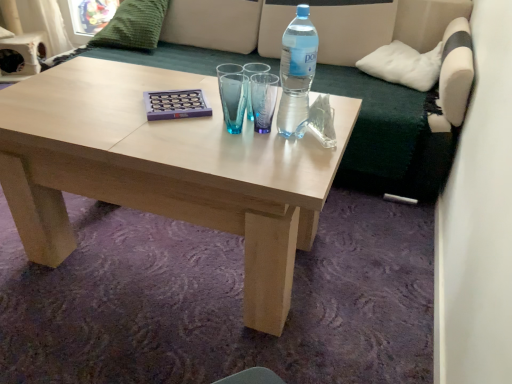
This screenshot has height=384, width=512. What do you see at coordinates (403, 65) in the screenshot?
I see `white soft cushion at upper right, the second pillow from the top` at bounding box center [403, 65].

Image resolution: width=512 pixels, height=384 pixels. Find the location of `transparent plastic bottle at upper right`. transparent plastic bottle at upper right is located at coordinates (297, 72).

Measure the distance between point (148,9) and camera.

Point (148,9) and camera are 7.57 feet apart.

Describe the element at coordinates (404, 41) in the screenshot. I see `green fabric couch at upper center` at that location.

Image resolution: width=512 pixels, height=384 pixels. I want to click on white soft cushion at upper right, arranged as the second pillow when viewed from the left, so click(x=403, y=65).

From a real-world perspective, relative to natural wood coffee table at center, is white soft cushion at upper right, arranged as the first pillow when viewed from the right, vertically above or below?

Clearly, from a real-world perspective, white soft cushion at upper right, arranged as the first pillow when viewed from the right, is above natural wood coffee table at center.

Which is more to the left, white soft cushion at upper right, marked as the 1th pillow in a bottom-to-top arrangement, or natural wood coffee table at center?

From the viewer's perspective, natural wood coffee table at center appears more on the left side.

Between white soft cushion at upper right, arranged as the first pillow when viewed from the right, and natural wood coffee table at center, which one has less height?

natural wood coffee table at center.

Considering the sizes of white soft cushion at upper right, arranged as the first pillow when viewed from the right, and natural wood coffee table at center in the image, is white soft cushion at upper right, arranged as the first pillow when viewed from the right, wider or thinner than natural wood coffee table at center?

In the image, white soft cushion at upper right, arranged as the first pillow when viewed from the right, appears to be more narrow than natural wood coffee table at center.

Between transparent plastic bottle at upper right and white soft cushion at upper right, the second pillow from the top, which one has less height?

white soft cushion at upper right, the second pillow from the top.

Considering the relative positions of transparent plastic bottle at upper right and white soft cushion at upper right, arranged as the first pillow when viewed from the right, in the image provided, is transparent plastic bottle at upper right to the right of white soft cushion at upper right, arranged as the first pillow when viewed from the right, from the viewer's perspective?

No, transparent plastic bottle at upper right is not to the right of white soft cushion at upper right, arranged as the first pillow when viewed from the right.

Who is more distant, transparent plastic bottle at upper right or white soft cushion at upper right, the second pillow from the top?

white soft cushion at upper right, the second pillow from the top, is behind.

This screenshot has height=384, width=512. What are the coordinates of `bottle below the white soft cushion at upper right, arranged as the second pillow when viewed from the left (from the image's perspective)` in the screenshot? It's located at (297, 72).

From a real-world perspective, who is located higher, green fabric couch at upper center or green knitted pillow at upper left, the second pillow positioned from the bottom?

From a 3D spatial view, green knitted pillow at upper left, the second pillow positioned from the bottom, is above.

Is green knitted pillow at upper left, marked as the second pillow in a right-to-left arrangement, at the back of green fabric couch at upper center?

Yes, green fabric couch at upper center is positioned with its back facing green knitted pillow at upper left, marked as the second pillow in a right-to-left arrangement.

Which of these two, green fabric couch at upper center or green knitted pillow at upper left, marked as the second pillow in a right-to-left arrangement, is smaller?

green knitted pillow at upper left, marked as the second pillow in a right-to-left arrangement, is smaller.

Could you measure the distance between green fabric couch at upper center and green knitted pillow at upper left, arranged as the first pillow when viewed from the left?

green fabric couch at upper center is 58.46 centimeters from green knitted pillow at upper left, arranged as the first pillow when viewed from the left.

From a real-world perspective, is natural wood coffee table at center beneath green knitted pillow at upper left, the second pillow positioned from the bottom?

Yes, from a real-world perspective, natural wood coffee table at center is beneath green knitted pillow at upper left, the second pillow positioned from the bottom.

Between natural wood coffee table at center and green knitted pillow at upper left, marked as the second pillow in a right-to-left arrangement, which one has larger size?

With larger size is natural wood coffee table at center.

Is natural wood coffee table at center aimed at green knitted pillow at upper left, marked as the second pillow in a right-to-left arrangement?

No, natural wood coffee table at center does not turn towards green knitted pillow at upper left, marked as the second pillow in a right-to-left arrangement.

Is transparent plastic bottle at upper right inside the boundaries of green knitted pillow at upper left, the second pillow positioned from the bottom, or outside?

transparent plastic bottle at upper right exists outside the volume of green knitted pillow at upper left, the second pillow positioned from the bottom.

Which is in front, transparent plastic bottle at upper right or green knitted pillow at upper left, marked as the second pillow in a right-to-left arrangement?

Positioned in front is transparent plastic bottle at upper right.

From a real-world perspective, which is physically above, transparent plastic bottle at upper right or green knitted pillow at upper left, marked as the second pillow in a right-to-left arrangement?

From a 3D spatial view, transparent plastic bottle at upper right is above.

Is transparent plastic bottle at upper right looking in the opposite direction of green knitted pillow at upper left, marked as the second pillow in a right-to-left arrangement?

No, green knitted pillow at upper left, marked as the second pillow in a right-to-left arrangement, is not at the back of transparent plastic bottle at upper right.

Which object is wider, natural wood coffee table at center or green fabric couch at upper center?

natural wood coffee table at center is wider.

From the image's perspective, between natural wood coffee table at center and green fabric couch at upper center, which one is located above?

green fabric couch at upper center is shown above in the image.

Is the depth of natural wood coffee table at center greater than that of green fabric couch at upper center?

No, the depth of natural wood coffee table at center is less than that of green fabric couch at upper center.

The image size is (512, 384). In order to click on coffee table that appears below the green fabric couch at upper center (from a real-world perspective) in this screenshot , I will do `click(163, 170)`.

Which is behind, point (413, 56) or point (283, 47)?

The point (413, 56) is more distant.

From the picture: How much distance is there between white soft cushion at upper right, marked as the 1th pillow in a bottom-to-top arrangement, and transparent plastic bottle at upper right?

white soft cushion at upper right, marked as the 1th pillow in a bottom-to-top arrangement, and transparent plastic bottle at upper right are 38.81 inches apart from each other.

Is white soft cushion at upper right, marked as the 1th pillow in a bottom-to-top arrangement, to the right of transparent plastic bottle at upper right from the viewer's perspective?

Correct, you'll find white soft cushion at upper right, marked as the 1th pillow in a bottom-to-top arrangement, to the right of transparent plastic bottle at upper right.

Do you think white soft cushion at upper right, arranged as the second pillow when viewed from the left, is within transparent plastic bottle at upper right, or outside of it?

The correct answer is: outside.

From a real-world perspective, starting from the natural wood coffee table at center, which pillow is the 1st one vertically above it? Please provide its 2D coordinates.

[(403, 65)]

At what (x,y) coordinates should I click in order to perform the action: click on pillow on the right of transparent plastic bottle at upper right. Please return your answer as a coordinate pair (x, y). Looking at the image, I should click on (403, 65).

Looking at the image, which one is located further to white soft cushion at upper right, the second pillow from the top, transparent plastic bottle at upper right or natural wood coffee table at center?

Based on the image, natural wood coffee table at center appears to be further to white soft cushion at upper right, the second pillow from the top.

Estimate the real-world distances between objects in this image. Which object is further from green fabric couch at upper center, green knitted pillow at upper left, arranged as the first pillow when viewed from the left, or white soft cushion at upper right, arranged as the first pillow when viewed from the right?

green knitted pillow at upper left, arranged as the first pillow when viewed from the left.

Estimate the real-world distances between objects in this image. Which object is further from green knitted pillow at upper left, which ranks as the first pillow in top-to-bottom order, transparent plastic bottle at upper right or white soft cushion at upper right, the second pillow from the top?

transparent plastic bottle at upper right is further to green knitted pillow at upper left, which ranks as the first pillow in top-to-bottom order.

Looking at the image, which one is located further to green fabric couch at upper center, green knitted pillow at upper left, which ranks as the first pillow in top-to-bottom order, or transparent plastic bottle at upper right?

transparent plastic bottle at upper right is positioned further to the anchor green fabric couch at upper center.

Which object lies nearer to the anchor point natural wood coffee table at center, white soft cushion at upper right, arranged as the second pillow when viewed from the left, or green knitted pillow at upper left, the second pillow positioned from the bottom?

white soft cushion at upper right, arranged as the second pillow when viewed from the left, lies closer to natural wood coffee table at center than the other object.

Based on their spatial positions, is natural wood coffee table at center or transparent plastic bottle at upper right further from green fabric couch at upper center?

transparent plastic bottle at upper right lies further to green fabric couch at upper center than the other object.

Estimate the real-world distances between objects in this image. Which object is further from natural wood coffee table at center, green fabric couch at upper center or green knitted pillow at upper left, the second pillow positioned from the bottom?

green knitted pillow at upper left, the second pillow positioned from the bottom.

Which object lies nearer to the anchor point green fabric couch at upper center, white soft cushion at upper right, marked as the 1th pillow in a bottom-to-top arrangement, or green knitted pillow at upper left, the second pillow positioned from the bottom?

white soft cushion at upper right, marked as the 1th pillow in a bottom-to-top arrangement.

I want to click on studio couch between transparent plastic bottle at upper right and white soft cushion at upper right, arranged as the first pillow when viewed from the right, from front to back, so click(404, 41).

What are the coordinates of `studio couch situated between natural wood coffee table at center and white soft cushion at upper right, marked as the 1th pillow in a bottom-to-top arrangement, from left to right` in the screenshot? It's located at (404, 41).

Locate an element on the screen. The image size is (512, 384). bottle between natural wood coffee table at center and white soft cushion at upper right, marked as the 1th pillow in a bottom-to-top arrangement, in the horizontal direction is located at coordinates (297, 72).

At what (x,y) coordinates should I click in order to perform the action: click on pillow between natural wood coffee table at center and white soft cushion at upper right, arranged as the second pillow when viewed from the left, in the horizontal direction. Please return your answer as a coordinate pair (x, y). Looking at the image, I should click on (133, 26).